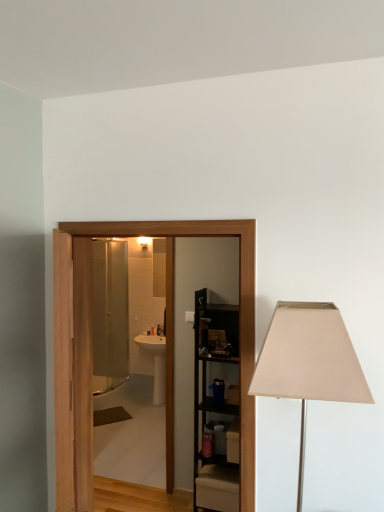
Question: Is white glossy sink at center facing towards beige fabric lampshade at right?

Choices:
 (A) no
 (B) yes

Answer: (A)

Question: From a real-world perspective, is white glossy sink at center below beige fabric lampshade at right?

Choices:
 (A) yes
 (B) no

Answer: (A)

Question: Can you confirm if white glossy sink at center is taller than beige fabric lampshade at right?

Choices:
 (A) no
 (B) yes

Answer: (A)

Question: Can you confirm if white glossy sink at center is thinner than beige fabric lampshade at right?

Choices:
 (A) yes
 (B) no

Answer: (A)

Question: Does white glossy sink at center appear on the left side of beige fabric lampshade at right?

Choices:
 (A) no
 (B) yes

Answer: (B)

Question: From a real-world perspective, is white glossy sink at center located higher than beige fabric lampshade at right?

Choices:
 (A) yes
 (B) no

Answer: (B)

Question: Is black metal shelving unit at center completely or partially outside of beige fabric lampshade at right?

Choices:
 (A) no
 (B) yes

Answer: (B)

Question: Is black metal shelving unit at center wider than beige fabric lampshade at right?

Choices:
 (A) no
 (B) yes

Answer: (A)

Question: Can you confirm if black metal shelving unit at center is shorter than beige fabric lampshade at right?

Choices:
 (A) yes
 (B) no

Answer: (B)

Question: Considering the relative sizes of black metal shelving unit at center and beige fabric lampshade at right in the image provided, is black metal shelving unit at center smaller than beige fabric lampshade at right?

Choices:
 (A) yes
 (B) no

Answer: (B)

Question: Is black metal shelving unit at center looking in the opposite direction of beige fabric lampshade at right?

Choices:
 (A) no
 (B) yes

Answer: (A)

Question: Is black metal shelving unit at center taller than beige fabric lampshade at right?

Choices:
 (A) yes
 (B) no

Answer: (A)

Question: Considering the relative sizes of black metal shelving unit at center and wooden door at center in the image provided, is black metal shelving unit at center taller than wooden door at center?

Choices:
 (A) no
 (B) yes

Answer: (B)